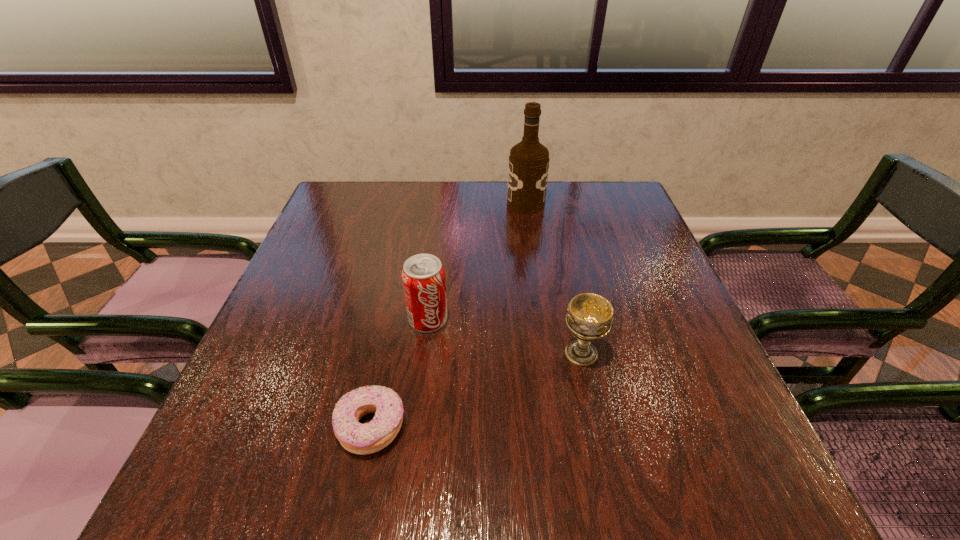
Identify the location of the farthest object. The width and height of the screenshot is (960, 540). (528, 168).

The image size is (960, 540). In order to click on alcohol in this screenshot , I will do `click(528, 168)`.

Locate an element on the screen. the third nearest object is located at coordinates (423, 276).

Locate an element on the screen. The image size is (960, 540). the second tallest object is located at coordinates [x=423, y=276].

Locate an element on the screen. the third farthest object is located at coordinates (589, 318).

This screenshot has height=540, width=960. Identify the location of chalice. (589, 318).

In order to click on the nearest object in this screenshot , I will do `click(362, 439)`.

Find the location of `doughnut`. doughnut is located at coordinates (362, 439).

Image resolution: width=960 pixels, height=540 pixels. I want to click on vacant space located 0.200m on the label of the farthest object, so click(440, 204).

Where is `free region located on the label of the farthest object`? free region located on the label of the farthest object is located at coordinates pyautogui.click(x=386, y=204).